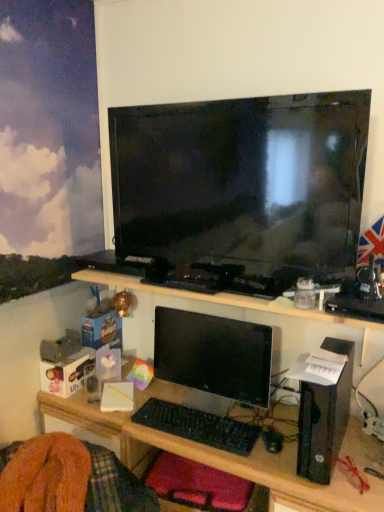
Locate an element on the screen. The width and height of the screenshot is (384, 512). vacant space in front of black plastic mouse at lower center is located at coordinates (294, 470).